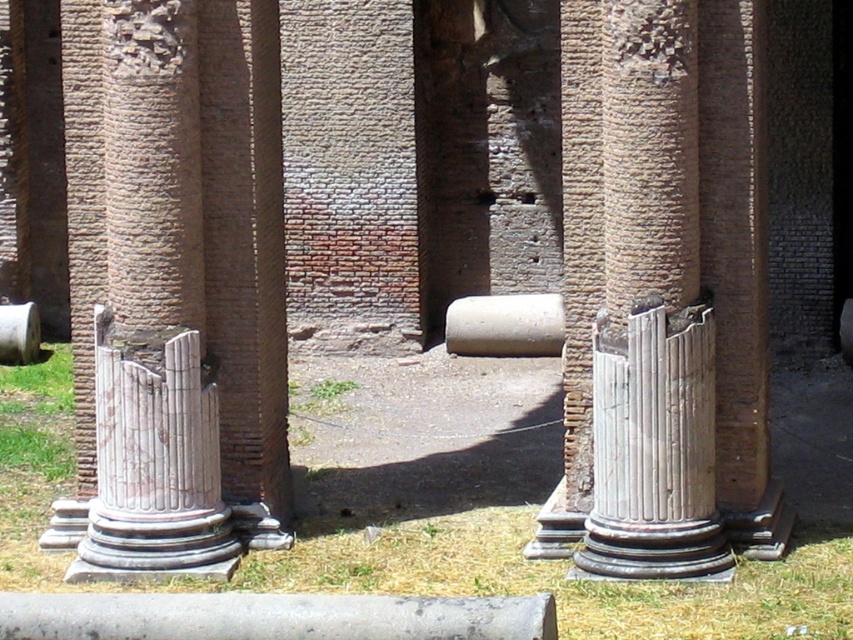
You are standing at the entrance of the ancient ruins and see the white marble column at center. If you want to reach the column, in which direction should you move relative to your current position?

The white marble column at center is located at point [648,316], so you should move forward and slightly to the right to reach it.